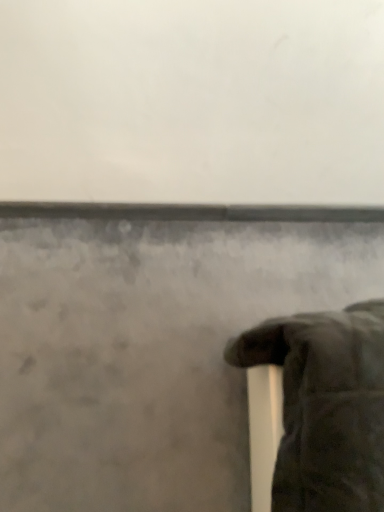
The height and width of the screenshot is (512, 384). What do you see at coordinates (152, 342) in the screenshot?
I see `matte gray wall at lower left` at bounding box center [152, 342].

You are a GUI agent. You are given a task and a screenshot of the screen. Output one action in this format:
    pyautogui.click(x=<x>, y=<y>)
    Task: Click on the matte gray wall at lower left
    Image resolution: width=384 pixels, height=512 pixels.
    Given the screenshot: What is the action you would take?
    pyautogui.click(x=152, y=342)

Measure the distance between matte gray wall at lower left and camera.

matte gray wall at lower left is 3.42 feet from camera.

Where is `matte gray wall at lower left`? This screenshot has width=384, height=512. matte gray wall at lower left is located at coordinates (152, 342).